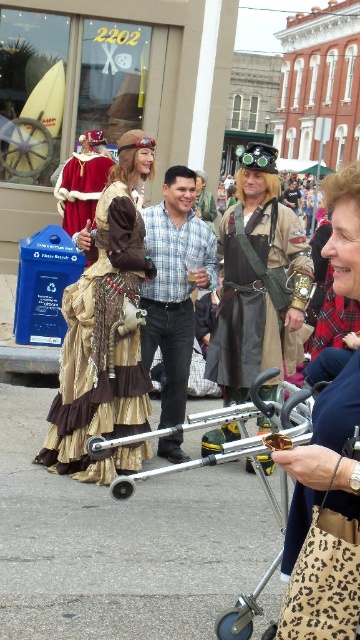
Is point (245, 173) farther from camera compared to point (266, 579)?

Yes, point (245, 173) is farther from viewer.

Can you confirm if steampunk attire at center is bigger than metallic silver baby carriage at center?

Yes.

Locate an element on the screen. This screenshot has height=640, width=360. steampunk attire at center is located at coordinates (258, 282).

Can you confirm if leopard print purse at center is shorter than steampunk attire at center?

Yes.

Is leopard print purse at center behind steampunk attire at center?

No, leopard print purse at center is in front of steampunk attire at center.

Where is `leopard print purse at center`? The height and width of the screenshot is (640, 360). leopard print purse at center is located at coordinates (324, 518).

Does gold fabric dress at center have a lesser width compared to metallic silver baby carriage at center?

Correct, gold fabric dress at center's width is less than metallic silver baby carriage at center's.

Is point (133, 470) closer to camera compared to point (263, 477)?

No, it is not.

Find the location of a particular element. This screenshot has width=360, height=640. gold fabric dress at center is located at coordinates (105, 332).